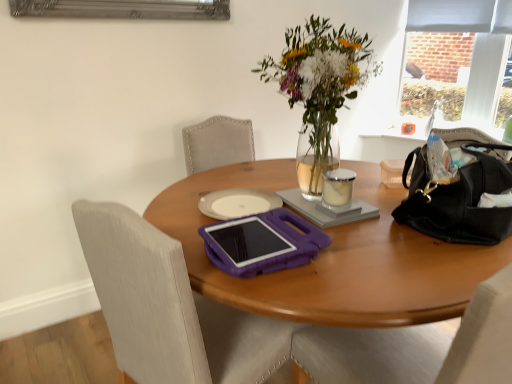
Question: Considering the positions of point (209, 342) and point (207, 228), is point (209, 342) closer or farther from the camera than point (207, 228)?

Choices:
 (A) farther
 (B) closer

Answer: (A)

Question: Is purple plastic chair at center wider or thinner than purple plastic tablet at center?

Choices:
 (A) wide
 (B) thin

Answer: (A)

Question: Which of these objects is positioned farthest from the purple plastic chair at center?

Choices:
 (A) matte gray curtain at upper right
 (B) purple plastic tablet at center
 (C) gray matte notebook at center
 (D) translucent glass vase at upper center
 (E) clear glass candle at center

Answer: (A)

Question: Estimate the real-world distances between objects in this image. Which object is closer to the purple plastic chair at center?

Choices:
 (A) clear glass candle at center
 (B) purple plastic tablet at center
 (C) gray matte notebook at center
 (D) translucent glass vase at upper center
 (E) black leather handbag at right

Answer: (B)